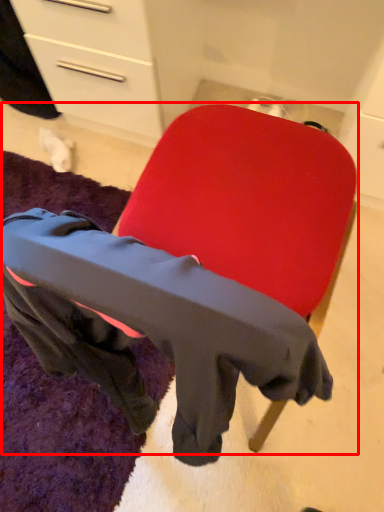
Question: From the image's perspective, what is the correct spatial positioning of chair (annotated by the red box) in reference to mat?

Choices:
 (A) above
 (B) below

Answer: (A)